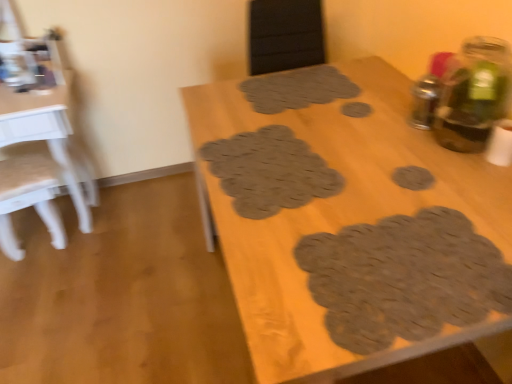
Where is `free space between brown textured mat at bottom right, which is the 1th footprint in front-to-back order, and brown textured coaster at center-right, the third footprint positioned from the front`? The image size is (512, 384). free space between brown textured mat at bottom right, which is the 1th footprint in front-to-back order, and brown textured coaster at center-right, the third footprint positioned from the front is located at coordinates (384, 206).